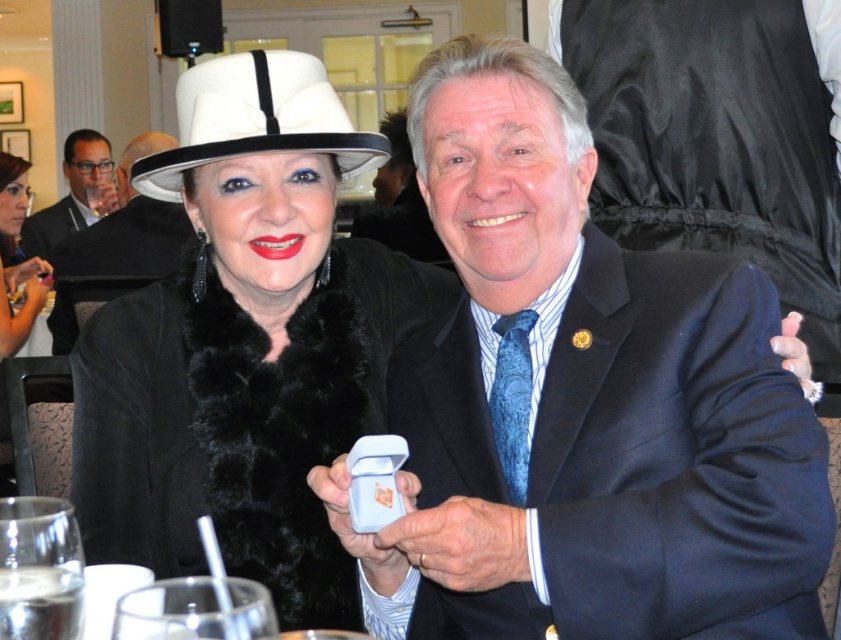
You are a photographer at the event and need to adjust the lighting to ensure both the matte black hat at upper left and the matte black suit at upper left are evenly illuminated. Given their sizes, which object requires a wider light spread to cover its entire surface?

The matte black hat at upper left requires a wider light spread because its width surpasses that of the matte black suit at upper left.

You are a photographer at a formal event and need to adjust the lighting to ensure both the blue satin suit at center and the white felt dress hat at upper left are well lit. Based on their positions, which object is farther to the right and would require more light adjustment on that side?

The blue satin suit at center is positioned on the right side of white felt dress hat at upper left, so it is farther to the right and would require more light adjustment on that side.

You are standing at the point marked as point (x=279, y=88) and want to take a photo of the two people at the formal event. The camera you have can focus on subjects up to 5 feet away. Will you be able to capture a clear photo of them?

The distance between point (x=279, y=88) and the camera is 5.45 feet, which exceeds the camera focus limit of 5 feet. Therefore, the camera cannot capture a clear photo of them.